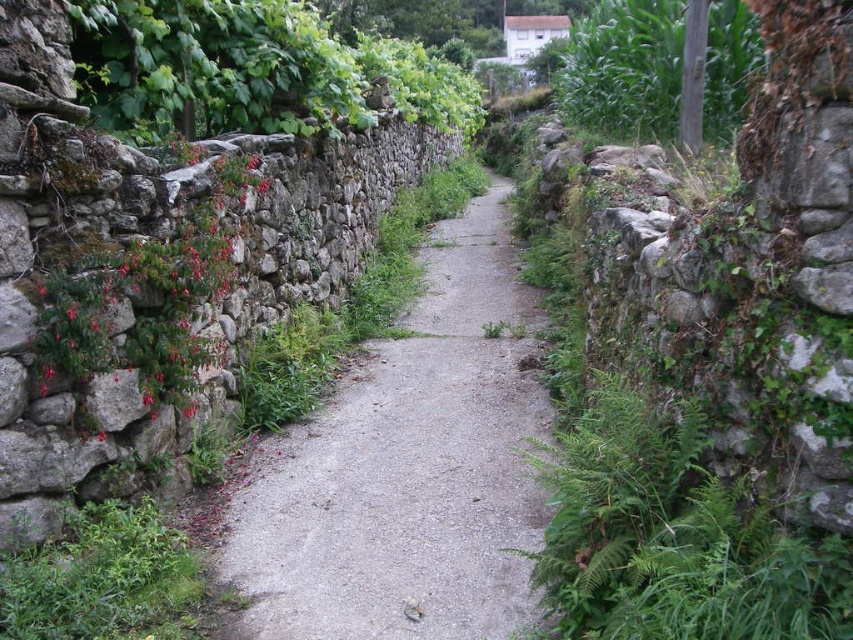
Question: Estimate the real-world distances between objects in this image. Which object is farther from the green leafy plant at upper left?

Choices:
 (A) green leafy fern at right
 (B) pink matte flowers at left
 (C) green leafy plant at upper right
 (D) gray gravel path at center

Answer: (C)

Question: Is pink matte flowers at left closer to camera compared to green leafy plant at upper right?

Choices:
 (A) yes
 (B) no

Answer: (A)

Question: Does pink matte flowers at left appear over green leafy plant at upper right?

Choices:
 (A) yes
 (B) no

Answer: (B)

Question: Among these objects, which one is farthest from the camera?

Choices:
 (A) pink matte flowers at left
 (B) green leafy fern at right
 (C) gray gravel path at center

Answer: (A)

Question: Does gray gravel path at center appear on the right side of green leafy fern at right?

Choices:
 (A) yes
 (B) no

Answer: (B)

Question: Which object is the closest to the green leafy fern at right?

Choices:
 (A) gray gravel path at center
 (B) pink matte flowers at left
 (C) green leafy plant at upper right

Answer: (A)